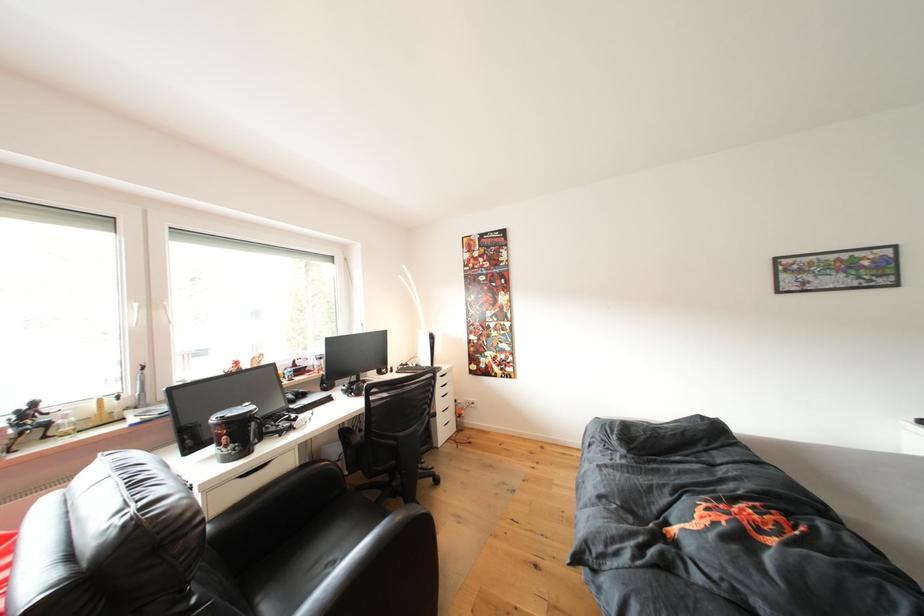
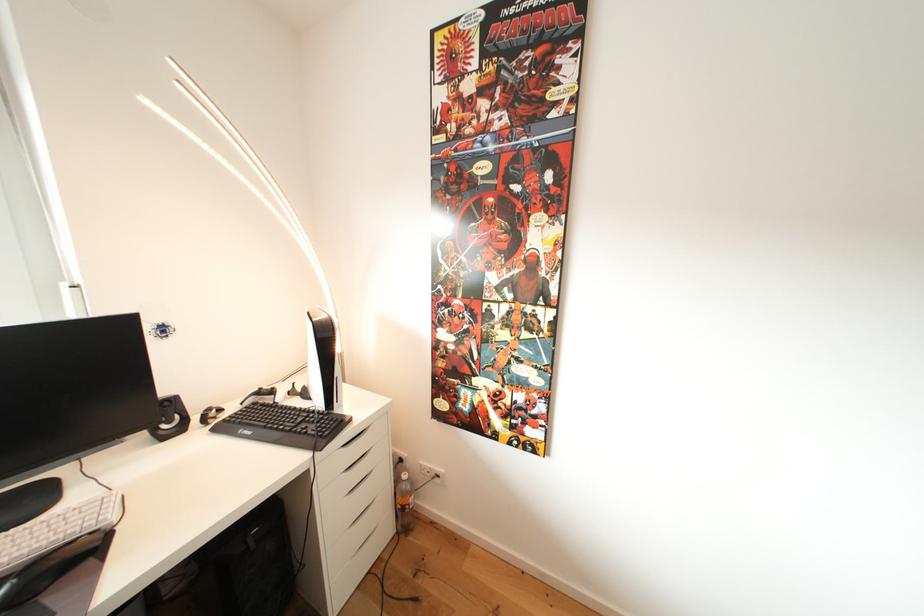
Where in the second image is the point corresponding to (x=468, y=411) from the first image?

(412, 492)